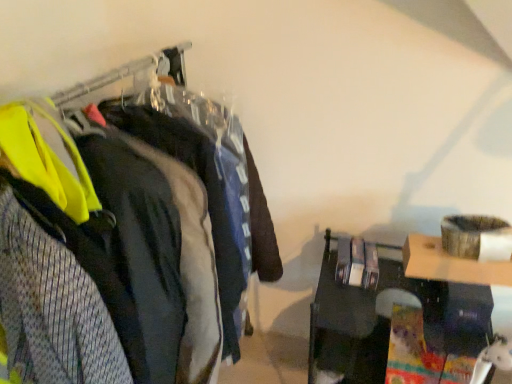
This screenshot has width=512, height=384. Describe the element at coordinates (396, 319) in the screenshot. I see `black glossy table at lower right` at that location.

Identify the location of matte black jacket at left, the first clothing in the back-to-front sequence. This screenshot has height=384, width=512. (207, 196).

The image size is (512, 384). Find the location of `black glossy table at lower right`. black glossy table at lower right is located at coordinates (x=396, y=319).

Considering the positions of objects yellow reflective vest at left, which is counted as the second clothing, starting from the back, and matte black jacket at left in the image provided, who is more to the left, yellow reflective vest at left, which is counted as the second clothing, starting from the back, or matte black jacket at left?

From the viewer's perspective, yellow reflective vest at left, which is counted as the second clothing, starting from the back, appears more on the left side.

From the image's perspective, which object appears higher, yellow reflective vest at left, which is counted as the second clothing, starting from the back, or matte black jacket at left?

yellow reflective vest at left, which is counted as the second clothing, starting from the back, appears higher in the image.

In the scene shown: Can you see yellow reflective vest at left, which is counted as the 1th clothing, starting from the front, touching matte black jacket at left?

No, yellow reflective vest at left, which is counted as the 1th clothing, starting from the front, is not making contact with matte black jacket at left.

How different are the orientations of matte black jacket at left and matte black jacket at left, the first clothing in the back-to-front sequence, in degrees?

The angular difference between matte black jacket at left and matte black jacket at left, the first clothing in the back-to-front sequence, is 2.11 degrees.

Considering the relative sizes of matte black jacket at left and matte black jacket at left, the first clothing in the back-to-front sequence, in the image provided, is matte black jacket at left shorter than matte black jacket at left, the first clothing in the back-to-front sequence,?

Incorrect, the height of matte black jacket at left does not fall short of that of matte black jacket at left, the first clothing in the back-to-front sequence.

Is matte black jacket at left positioned before matte black jacket at left, the first clothing in the back-to-front sequence?

Yes, matte black jacket at left is in front of matte black jacket at left, the first clothing in the back-to-front sequence.

Considering the relative sizes of black glossy table at lower right and matte black jacket at left, positioned as the second clothing in front-to-back order, in the image provided, is black glossy table at lower right shorter than matte black jacket at left, positioned as the second clothing in front-to-back order,?

Yes.

Does point (426, 297) lie behind point (250, 248)?

No, it is in front of (250, 248).

Which object is thinner, black glossy table at lower right or matte black jacket at left, positioned as the second clothing in front-to-back order?

black glossy table at lower right.

Are black glossy table at lower right and yellow reflective vest at left, which is counted as the 1th clothing, starting from the front, making contact?

No, black glossy table at lower right is not next to yellow reflective vest at left, which is counted as the 1th clothing, starting from the front.

What's the angular difference between black glossy table at lower right and yellow reflective vest at left, which is counted as the second clothing, starting from the back,'s facing directions?

They differ by 73.4 degrees in their facing directions.

Is black glossy table at lower right facing away from yellow reflective vest at left, which is counted as the 1th clothing, starting from the front?

That's not correct — black glossy table at lower right is not looking away from yellow reflective vest at left, which is counted as the 1th clothing, starting from the front.

Does black glossy table at lower right have a greater height compared to yellow reflective vest at left, which is counted as the 1th clothing, starting from the front?

Incorrect, the height of black glossy table at lower right is not larger of that of yellow reflective vest at left, which is counted as the 1th clothing, starting from the front.

What's the angular difference between matte black jacket at left, positioned as the second clothing in front-to-back order, and yellow reflective vest at left, which is counted as the second clothing, starting from the back,'s facing directions?

There is a 9.26-degree angle between the facing directions of matte black jacket at left, positioned as the second clothing in front-to-back order, and yellow reflective vest at left, which is counted as the second clothing, starting from the back.

Considering the sizes of matte black jacket at left, the first clothing in the back-to-front sequence, and yellow reflective vest at left, which is counted as the 1th clothing, starting from the front, in the image, is matte black jacket at left, the first clothing in the back-to-front sequence, taller or shorter than yellow reflective vest at left, which is counted as the 1th clothing, starting from the front,?

matte black jacket at left, the first clothing in the back-to-front sequence, is taller than yellow reflective vest at left, which is counted as the 1th clothing, starting from the front.

Who is bigger, matte black jacket at left, positioned as the second clothing in front-to-back order, or yellow reflective vest at left, which is counted as the second clothing, starting from the back?

yellow reflective vest at left, which is counted as the second clothing, starting from the back.

Locate an element on the screen. clothing on the right of yellow reflective vest at left, which is counted as the 1th clothing, starting from the front is located at coordinates (207, 196).

Does point (233, 289) come in front of point (415, 297)?

Yes, point (233, 289) is in front of point (415, 297).

How much distance is there between matte black jacket at left, positioned as the second clothing in front-to-back order, and black glossy table at lower right?

They are 21.28 inches apart.

Based on the photo, considering the relative positions of matte black jacket at left, positioned as the second clothing in front-to-back order, and black glossy table at lower right in the image provided, is matte black jacket at left, positioned as the second clothing in front-to-back order, to the right of black glossy table at lower right from the viewer's perspective?

Incorrect, matte black jacket at left, positioned as the second clothing in front-to-back order, is not on the right side of black glossy table at lower right.

From a real-world perspective, is matte black jacket at left, positioned as the second clothing in front-to-back order, positioned under black glossy table at lower right based on gravity?

No.

Which of these two, matte black jacket at left or yellow reflective vest at left, which is counted as the 1th clothing, starting from the front, is smaller?

Smaller between the two is yellow reflective vest at left, which is counted as the 1th clothing, starting from the front.

From a real-world perspective, does matte black jacket at left stand above yellow reflective vest at left, which is counted as the second clothing, starting from the back?

Incorrect, from a real-world perspective, matte black jacket at left is lower than yellow reflective vest at left, which is counted as the second clothing, starting from the back.

Find the location of a particular element. This screenshot has height=384, width=512. clothing in front of the matte black jacket at left is located at coordinates (52, 309).

Identify the location of closet below the matte black jacket at left, positioned as the second clothing in front-to-back order (from the image's perspective). (125, 236).

Which object lies nearer to the anchor point black glossy table at lower right, matte black jacket at left or yellow reflective vest at left, which is counted as the 1th clothing, starting from the front?

Based on the image, matte black jacket at left appears to be nearer to black glossy table at lower right.

When comparing their distances from matte black jacket at left, positioned as the second clothing in front-to-back order, does black glossy table at lower right or yellow reflective vest at left, which is counted as the second clothing, starting from the back, seem further?

Among the two, black glossy table at lower right is located further to matte black jacket at left, positioned as the second clothing in front-to-back order.

In the scene shown: Looking at the image, which one is located closer to matte black jacket at left, yellow reflective vest at left, which is counted as the 1th clothing, starting from the front, or matte black jacket at left, positioned as the second clothing in front-to-back order?

Among the two, matte black jacket at left, positioned as the second clothing in front-to-back order, is located nearer to matte black jacket at left.

Looking at the image, which one is located further to matte black jacket at left, black glossy table at lower right or matte black jacket at left, positioned as the second clothing in front-to-back order?

black glossy table at lower right lies further to matte black jacket at left than the other object.

From the image, which object appears to be nearer to matte black jacket at left, the first clothing in the back-to-front sequence, matte black jacket at left or yellow reflective vest at left, which is counted as the 1th clothing, starting from the front?

matte black jacket at left is positioned closer to the anchor matte black jacket at left, the first clothing in the back-to-front sequence.

Based on their spatial positions, is black glossy table at lower right or matte black jacket at left, positioned as the second clothing in front-to-back order, closer to yellow reflective vest at left, which is counted as the second clothing, starting from the back?

matte black jacket at left, positioned as the second clothing in front-to-back order.

Based on their spatial positions, is matte black jacket at left, positioned as the second clothing in front-to-back order, or black glossy table at lower right further from matte black jacket at left?

Result: Based on the image, black glossy table at lower right appears to be further to matte black jacket at left.

Which object lies nearer to the anchor point matte black jacket at left, yellow reflective vest at left, which is counted as the 1th clothing, starting from the front, or black glossy table at lower right?

The object closer to matte black jacket at left is yellow reflective vest at left, which is counted as the 1th clothing, starting from the front.

This screenshot has width=512, height=384. Find the location of `closet situated between yellow reflective vest at left, which is counted as the second clothing, starting from the back, and black glossy table at lower right from left to right`. closet situated between yellow reflective vest at left, which is counted as the second clothing, starting from the back, and black glossy table at lower right from left to right is located at coordinates (125, 236).

Identify the location of clothing situated between matte black jacket at left and black glossy table at lower right from left to right. The height and width of the screenshot is (384, 512). (207, 196).

I want to click on closet between yellow reflective vest at left, which is counted as the 1th clothing, starting from the front, and matte black jacket at left, positioned as the second clothing in front-to-back order, from front to back, so click(125, 236).

Identify the location of clothing situated between yellow reflective vest at left, which is counted as the second clothing, starting from the back, and black glossy table at lower right from left to right. This screenshot has width=512, height=384. (207, 196).